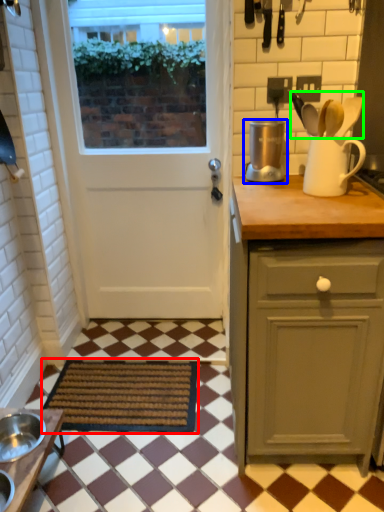
Question: Which object is positioned closest to mat (highlighted by a red box)? Select from kitchen appliance (highlighted by a blue box) and silverware (highlighted by a green box).

Choices:
 (A) kitchen appliance
 (B) silverware

Answer: (A)